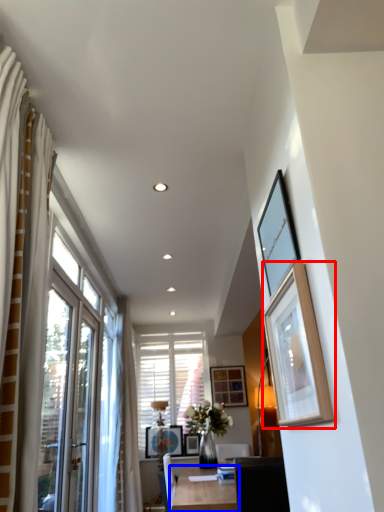
Question: Which object is closer to the camera taking this photo, picture frame (highlighted by a red box) or table (highlighted by a blue box)?

Choices:
 (A) picture frame
 (B) table

Answer: (A)